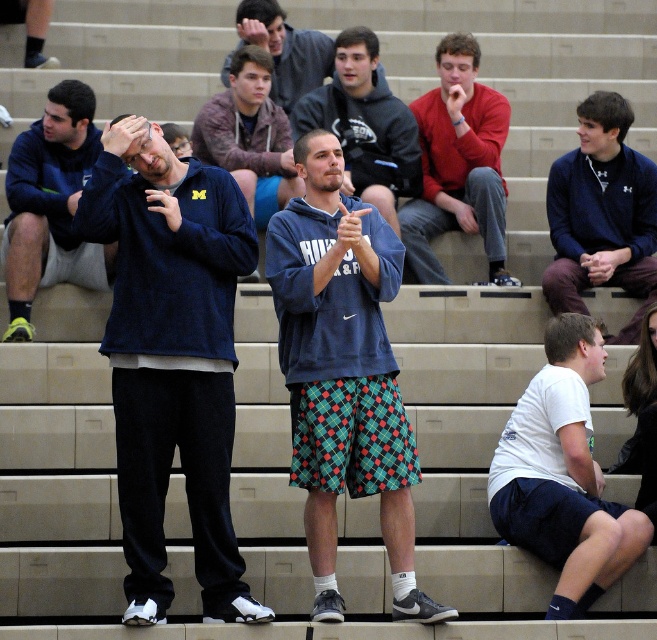
You are standing at the origin point in the gymnasium. The white cotton shirt at lower right is located at coordinates point (562,474). Can you determine the direction of the white cotton shirt at lower right relative to your position?

The white cotton shirt at lower right is located at coordinates point (562,474), which is to the lower right direction from your position at the origin.

You are a photographer setting up a shoot in the gymnasium. You need to position a light source so that it illuminates both the matte blue sweatshirt at center and the blue fleece sweatshirt at center equally. Given their height difference, where should you place the light source relative to them?

The matte blue sweatshirt at center is much taller than the blue fleece sweatshirt at center. To ensure both receive equal illumination, the light source should be positioned higher above them so that the light can reach both the taller and shorter figures without casting significant shadows.

You are a photographer trying to capture both the blue fleece jacket at upper right and the blue fleece sweatshirt at center in a single shot. Based on their positions, which one should you focus on first to ensure both are in frame?

You should focus on the blue fleece sweatshirt at center first because the blue fleece jacket at upper right is in front of it, so adjusting the frame to include the jacket will naturally include the sweatshirt as well.